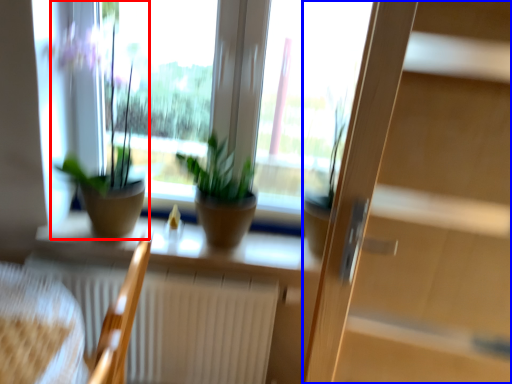
Question: Which point is closer to the camera, houseplant (highlighted by a red box) or screen door (highlighted by a blue box)?

Choices:
 (A) houseplant
 (B) screen door

Answer: (B)